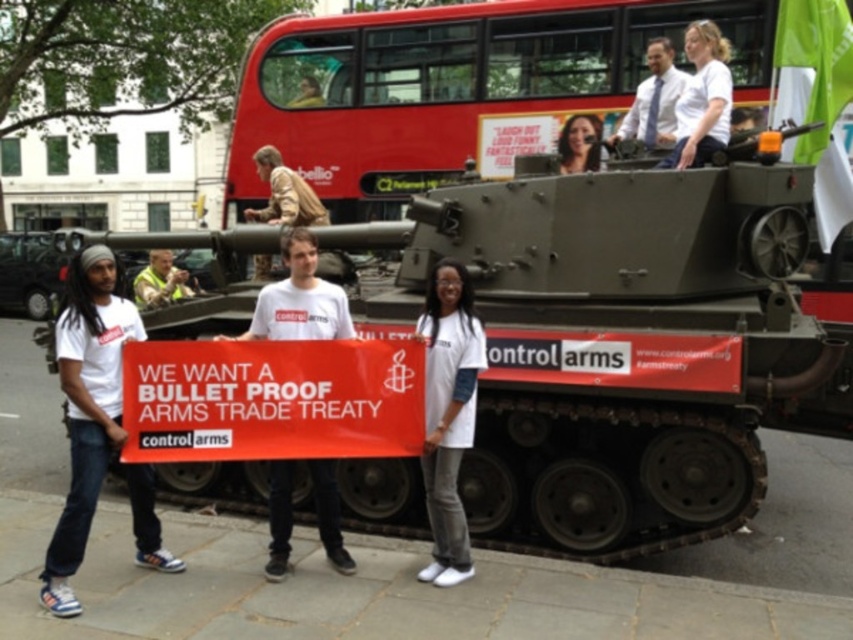
Can you confirm if matte gray tank at center is positioned to the right of white cotton t-shirt at left?

Indeed, matte gray tank at center is positioned on the right side of white cotton t-shirt at left.

Can you confirm if matte gray tank at center is bigger than white cotton t-shirt at left?

Indeed, matte gray tank at center has a larger size compared to white cotton t-shirt at left.

Where is `matte gray tank at center`? The width and height of the screenshot is (853, 640). matte gray tank at center is located at coordinates (622, 340).

Can you confirm if white cotton shirt at center is positioned to the left of smooth skin face at upper center?

Yes, white cotton shirt at center is to the left of smooth skin face at upper center.

From the picture: Does white cotton shirt at center lie in front of smooth skin face at upper center?

Yes, white cotton shirt at center is closer to the viewer.

Does point (431, 435) come in front of point (581, 141)?

Yes, point (431, 435) is closer to viewer.

What are the coordinates of `white cotton shirt at center` in the screenshot? It's located at (448, 413).

Which is below, matte gray tank at center or white cotton shirt at center?

white cotton shirt at center is lower down.

Is point (761, 417) positioned before point (428, 332)?

That is False.

Find the location of a particular element. The width and height of the screenshot is (853, 640). matte gray tank at center is located at coordinates (622, 340).